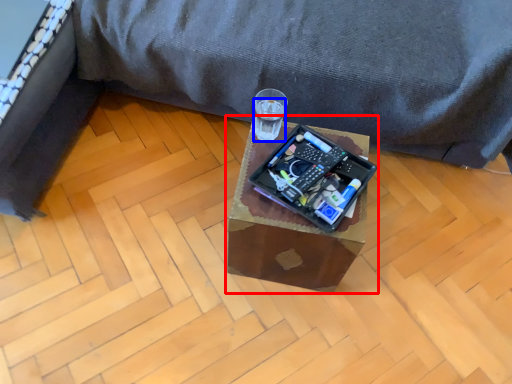
Question: Among these objects, which one is nearest to the camera, table (highlighted by a red box) or beverage (highlighted by a blue box)?

Choices:
 (A) table
 (B) beverage

Answer: (A)